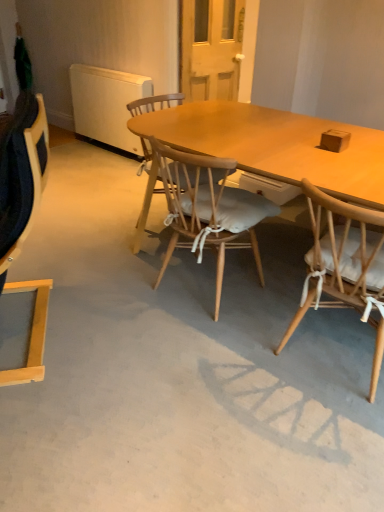
Question: Do you think brown matte box at upper right is within wooden chair with white cushion at right, the 3th chair from the left, or outside of it?

Choices:
 (A) inside
 (B) outside

Answer: (B)

Question: From a real-world perspective, is brown matte box at upper right positioned above or below wooden chair with white cushion at right, the 3th chair from the left?

Choices:
 (A) above
 (B) below

Answer: (A)

Question: Estimate the real-world distances between objects in this image. Which object is closer to the wooden chair with white cushion at right, placed as the 1th chair when sorted from right to left?

Choices:
 (A) white matte radiator at upper left
 (B) wooden chair with cushion at center, acting as the second chair starting from the right
 (C) brown matte box at upper right
 (D) light wood chair at left, marked as the third chair in a right-to-left arrangement

Answer: (B)

Question: Which object is positioned farthest from the white matte radiator at upper left?

Choices:
 (A) wooden chair with cushion at center, acting as the second chair starting from the right
 (B) light wood chair at left, marked as the third chair in a right-to-left arrangement
 (C) brown matte box at upper right
 (D) wooden chair with white cushion at right, placed as the 1th chair when sorted from right to left

Answer: (C)